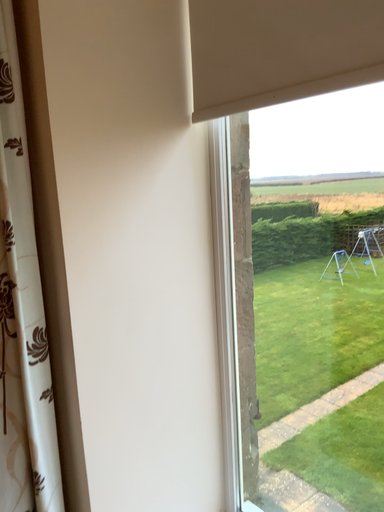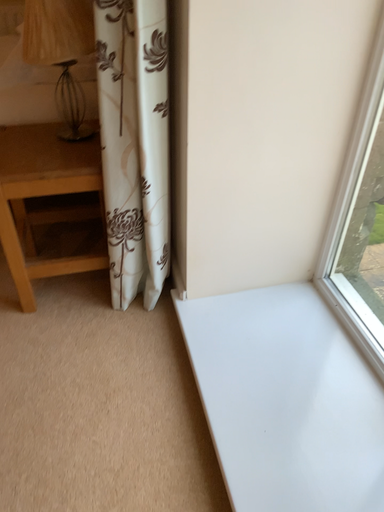
Question: Which way did the camera rotate in the video?

Choices:
 (A) rotated upward
 (B) rotated downward

Answer: (B)